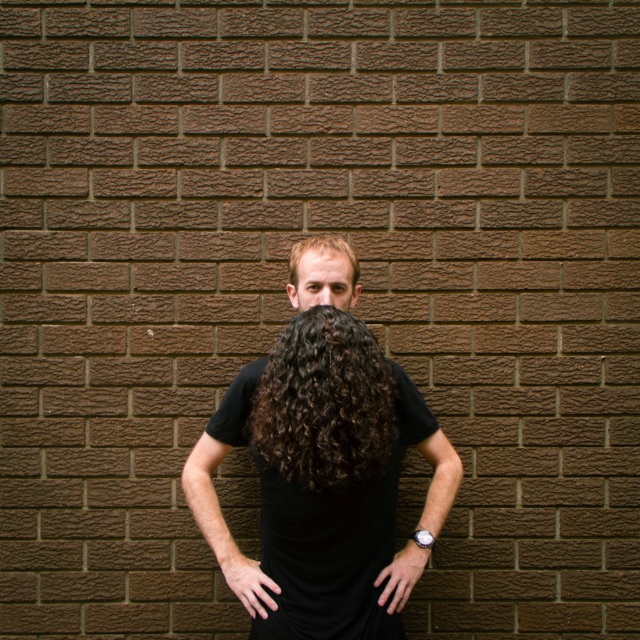
Question: Can you confirm if dark curly hair at center is bigger than blonde curly hair at center?

Choices:
 (A) no
 (B) yes

Answer: (B)

Question: Which object is farther from the camera taking this photo?

Choices:
 (A) dark curly hair at center
 (B) matte black face at center
 (C) blonde curly hair at center
 (D) black matte t-shirt at center

Answer: (C)

Question: Which object appears closest to the camera in this image?

Choices:
 (A) dark curly hair at center
 (B) black matte t-shirt at center
 (C) blonde curly hair at center

Answer: (A)

Question: Is black matte t-shirt at center in front of blonde curly hair at center?

Choices:
 (A) yes
 (B) no

Answer: (A)

Question: Can you confirm if black matte t-shirt at center is positioned to the left of blonde curly hair at center?

Choices:
 (A) no
 (B) yes

Answer: (A)

Question: Which of these objects is positioned closest to the black matte t-shirt at center?

Choices:
 (A) blonde curly hair at center
 (B) dark curly hair at center

Answer: (B)